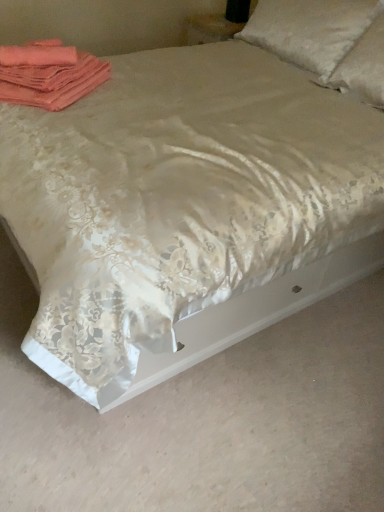
Question: Should I look upward or downward to see white satin pillow at upper right, which is the first pillow in left-to-right order?

Choices:
 (A) up
 (B) down

Answer: (A)

Question: Are satin white pillow at upper right, the first pillow in the right-to-left sequence, and coral fabric towels at upper left making contact?

Choices:
 (A) no
 (B) yes

Answer: (A)

Question: Is satin white pillow at upper right, the first pillow in the right-to-left sequence, outside of coral fabric towels at upper left?

Choices:
 (A) yes
 (B) no

Answer: (A)

Question: Is satin white pillow at upper right, the first pillow in the right-to-left sequence, shorter than coral fabric towels at upper left?

Choices:
 (A) yes
 (B) no

Answer: (B)

Question: From a real-world perspective, is satin white pillow at upper right, the 2th pillow from the left, located higher than coral fabric towels at upper left?

Choices:
 (A) yes
 (B) no

Answer: (A)

Question: Does satin white pillow at upper right, the 2th pillow from the left, have a smaller size compared to coral fabric towels at upper left?

Choices:
 (A) yes
 (B) no

Answer: (B)

Question: Is coral fabric towels at upper left at the back of satin white pillow at upper right, the 2th pillow from the left?

Choices:
 (A) no
 (B) yes

Answer: (A)

Question: From the image's perspective, is satin white pillow at upper right, the 2th pillow from the left, under white satin pillow at upper right, which is the first pillow in left-to-right order?

Choices:
 (A) yes
 (B) no

Answer: (A)

Question: Are satin white pillow at upper right, the first pillow in the right-to-left sequence, and white satin pillow at upper right, the second pillow from the right, far apart?

Choices:
 (A) no
 (B) yes

Answer: (A)

Question: Is the surface of satin white pillow at upper right, the first pillow in the right-to-left sequence, in direct contact with white satin pillow at upper right, the second pillow from the right?

Choices:
 (A) yes
 (B) no

Answer: (B)

Question: Does satin white pillow at upper right, the 2th pillow from the left, contain white satin pillow at upper right, which is the first pillow in left-to-right order?

Choices:
 (A) yes
 (B) no

Answer: (B)

Question: Is satin white pillow at upper right, the 2th pillow from the left, wider than white satin pillow at upper right, the second pillow from the right?

Choices:
 (A) no
 (B) yes

Answer: (B)

Question: From a real-world perspective, is satin white pillow at upper right, the first pillow in the right-to-left sequence, on white satin pillow at upper right, the second pillow from the right?

Choices:
 (A) no
 (B) yes

Answer: (B)

Question: Would you say white satin pillow at upper right, the second pillow from the right, contains coral fabric towels at upper left?

Choices:
 (A) no
 (B) yes

Answer: (A)